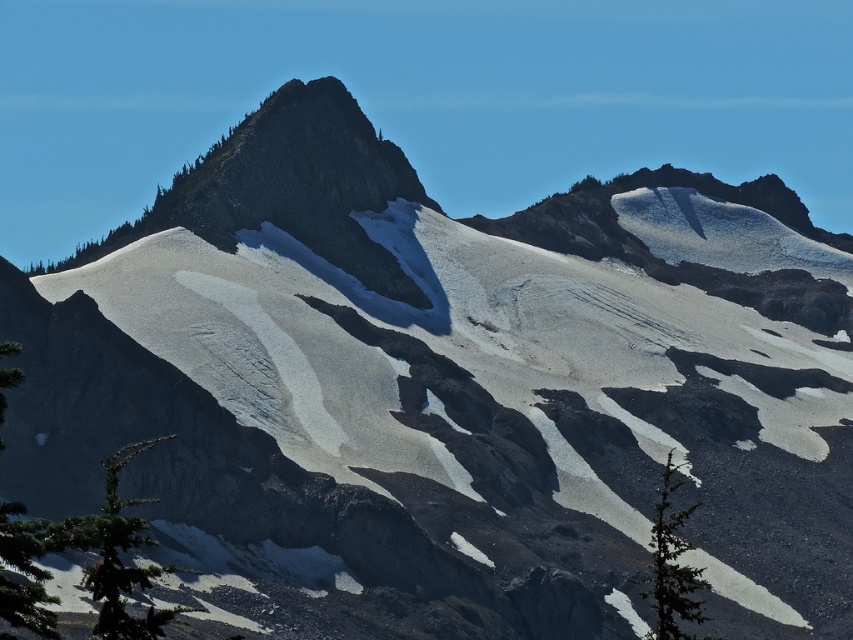
You are a hiker trying to identify landmarks in the mountain scene. You notice a specific point marked at coordinates point (119, 556). Based on the scene description, can you determine what this point is located on?

The point (119, 556) is located on the green textured pine tree at lower left.

You are a hiker planning to take a photo with both the green textured pine tree at lower left and the green matte tree at lower right in the frame. Which tree should you stand closer to if you want both trees to appear the same size in your photo?

You should stand closer to the green textured pine tree at lower left because it is shorter than the green matte tree at lower right. By moving closer to the shorter tree, you can balance their apparent sizes in the photo.

You are a hiker planning to take a photo of both the green textured pine tree at lower left and the green matte tree at lower right. Which tree should you move closer to in order to capture both trees in the frame without zooming in?

You should move closer to the green textured pine tree at lower left because it is smaller than the green matte tree at lower right, allowing you to include both in the frame by adjusting your distance.